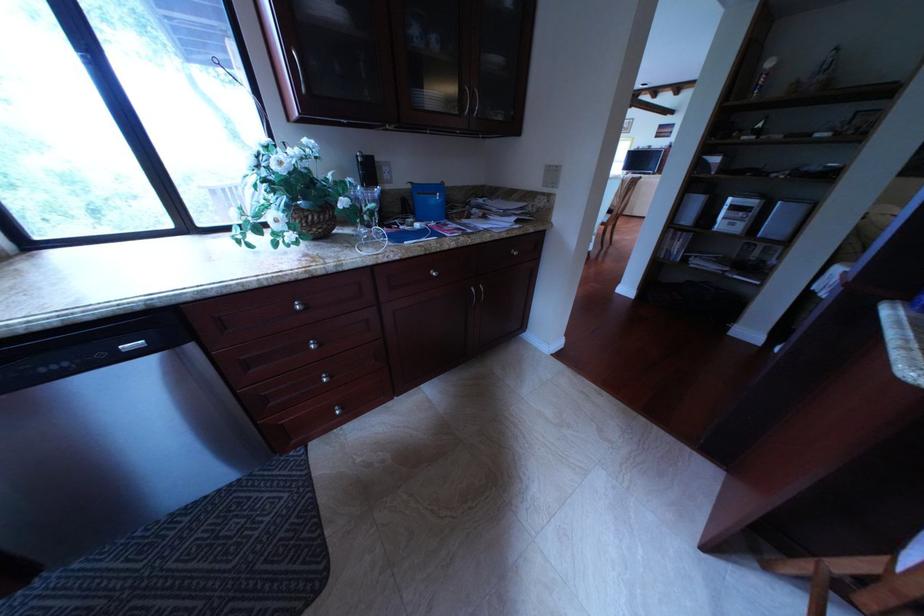
Image resolution: width=924 pixels, height=616 pixels. What do you see at coordinates (443, 188) in the screenshot? I see `a silver binder` at bounding box center [443, 188].